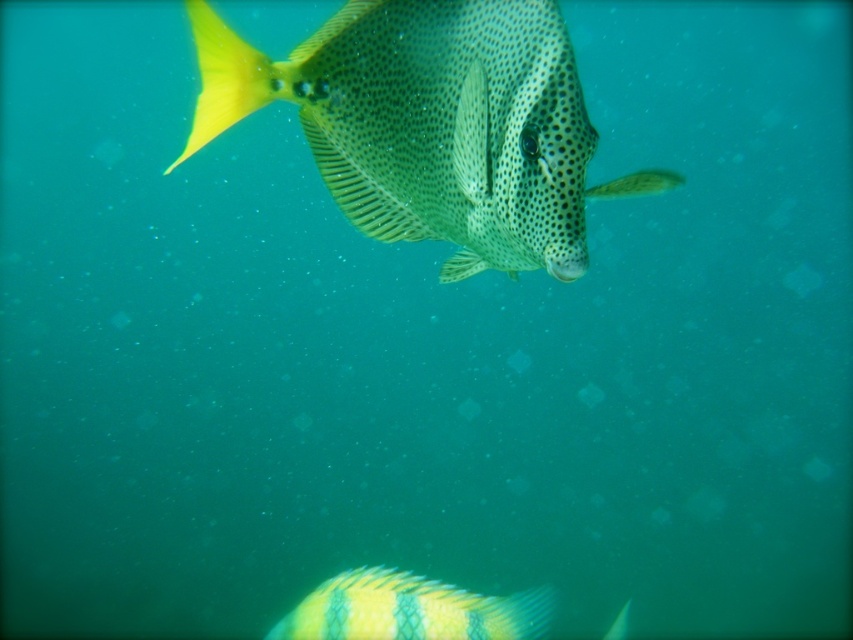
Looking at this image, is yellow-green striped fish at lower center to the left of yellow matte fin at upper left from the viewer's perspective?

In fact, yellow-green striped fish at lower center is to the right of yellow matte fin at upper left.

Which is above, yellow-green striped fish at lower center or yellow matte fin at upper left?

yellow matte fin at upper left is above.

Describe the element at coordinates (412, 609) in the screenshot. This screenshot has height=640, width=853. I see `yellow-green striped fish at lower center` at that location.

Where is `yellow-green striped fish at lower center`? Image resolution: width=853 pixels, height=640 pixels. yellow-green striped fish at lower center is located at coordinates (412, 609).

Does spotted yellow fish at center appear on the left side of yellow matte fin at upper left?

No, spotted yellow fish at center is not to the left of yellow matte fin at upper left.

The width and height of the screenshot is (853, 640). Find the location of `spotted yellow fish at center`. spotted yellow fish at center is located at coordinates (431, 124).

Image resolution: width=853 pixels, height=640 pixels. Describe the element at coordinates (431, 124) in the screenshot. I see `spotted yellow fish at center` at that location.

Is the position of spotted yellow fish at center less distant than that of yellow-green striped fish at lower center?

Yes.

Does point (207, 80) come in front of point (351, 634)?

Yes.

The image size is (853, 640). Identify the location of spotted yellow fish at center. (431, 124).